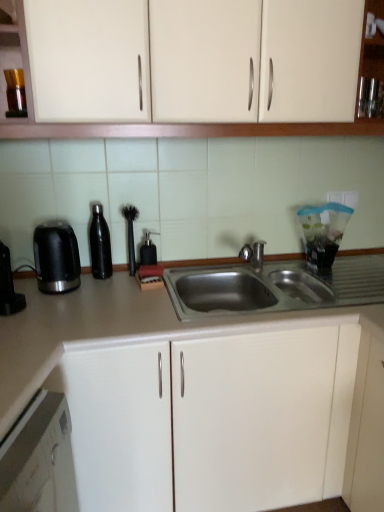
This screenshot has width=384, height=512. I want to click on unoccupied region to the right of black plastic kettle at left, so click(105, 293).